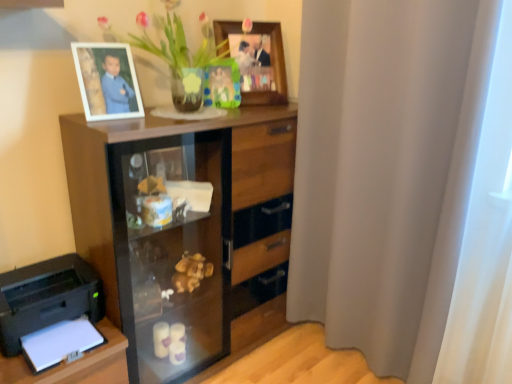
Question: Is wooden cabinet at center inside the boundaries of white fabric curtain at right, or outside?

Choices:
 (A) outside
 (B) inside

Answer: (A)

Question: Considering the positions of wooden cabinet at center and white fabric curtain at right in the image, is wooden cabinet at center taller or shorter than white fabric curtain at right?

Choices:
 (A) tall
 (B) short

Answer: (B)

Question: Estimate the real-world distances between objects in this image. Which object is closer to the black plastic printer at lower left?

Choices:
 (A) green matte picture frame at upper center, which is the 2th picture frame from right to left
 (B) wooden picture frame at upper center, marked as the 2th picture frame in a front-to-back arrangement
 (C) white matte picture frame at upper left, arranged as the 1th picture frame when viewed from the left
 (D) white fabric curtain at right
 (E) translucent glass vase at upper center

Answer: (C)

Question: Based on their relative distances, which object is nearer to the green matte picture frame at upper center, arranged as the 3th picture frame when viewed from the front?

Choices:
 (A) translucent glass vase at upper center
 (B) wooden cabinet at center
 (C) white fabric curtain at right
 (D) white matte picture frame at upper left, which ranks as the 3th picture frame in back-to-front order
 (E) black plastic printer at lower left

Answer: (A)